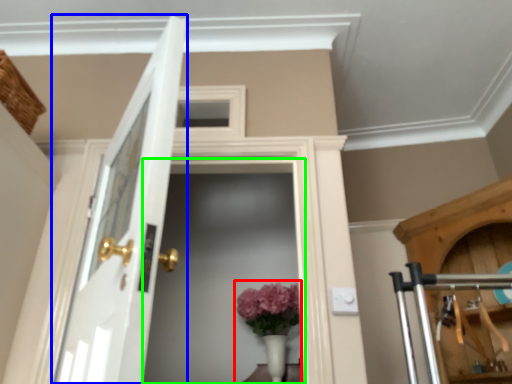
Question: Estimate the real-world distances between objects in this image. Which object is closer to floral arrangement (highlighted by a red box), door (highlighted by a blue box) or screen door (highlighted by a green box)?

Choices:
 (A) door
 (B) screen door

Answer: (B)